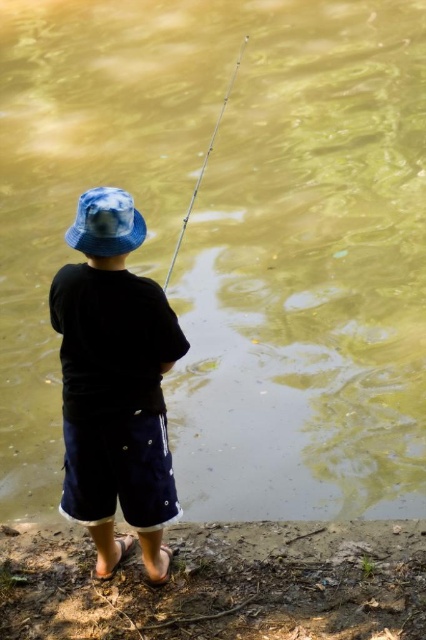
Question: Which object appears farthest from the camera in this image?

Choices:
 (A) blue tie-dye bucket hat at upper center
 (B) blue fabric bucket hat at center
 (C) silver metallic fishing pole at center

Answer: (C)

Question: Estimate the real-world distances between objects in this image. Which object is farther from the silver metallic fishing pole at center?

Choices:
 (A) blue fabric bucket hat at center
 (B) blue tie-dye bucket hat at upper center

Answer: (B)

Question: Is blue fabric bucket hat at center positioned in front of blue tie-dye bucket hat at upper center?

Choices:
 (A) no
 (B) yes

Answer: (B)

Question: Does blue fabric bucket hat at center have a greater width compared to silver metallic fishing pole at center?

Choices:
 (A) yes
 (B) no

Answer: (B)

Question: Which of the following is the farthest from the observer?

Choices:
 (A) blue fabric bucket hat at center
 (B) blue tie-dye bucket hat at upper center
 (C) silver metallic fishing pole at center

Answer: (C)

Question: Is blue fabric bucket hat at center above silver metallic fishing pole at center?

Choices:
 (A) no
 (B) yes

Answer: (A)